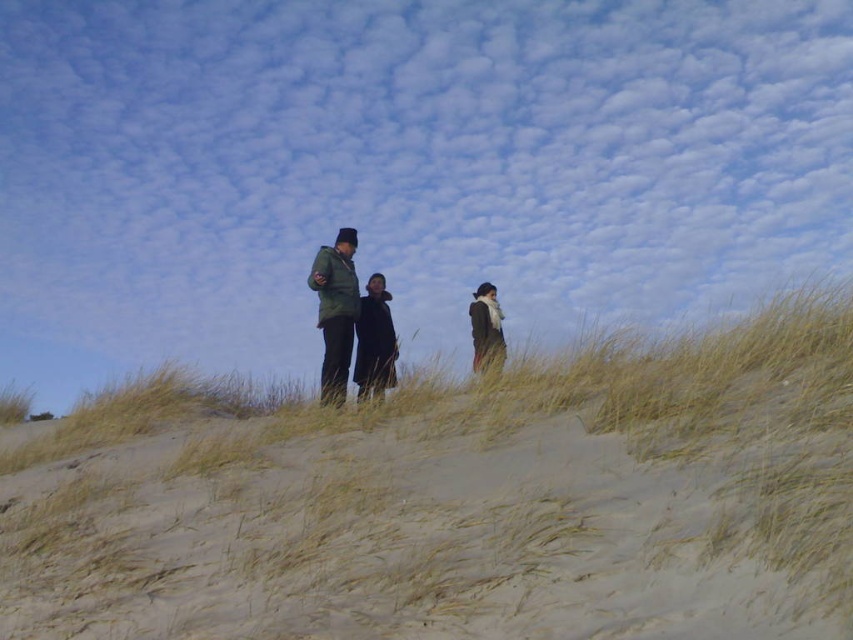
You are standing at the origin point in the scene. Which direction should you move to reach the dry grass at center?

The dry grass at center is located at coordinates point (456, 499), so you should move northeast to reach it.

You are planning to take a photo of the dry grass at center and the green matte jacket at center. Which object should you focus on first if you want to capture both in sharp focus?

The dry grass at center is smaller than the green matte jacket at center, so you should focus on the green matte jacket at center first to ensure both are in sharp focus.